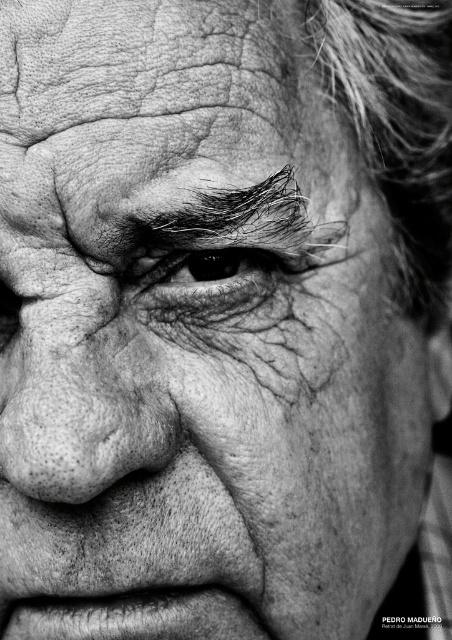
Is smooth skin forehead at upper center closer to camera compared to dull skin nose at center?

No, it is not.

Does smooth skin forehead at upper center come behind dull skin nose at center?

Yes, it is.

Which is in front, point (123, 72) or point (59, 420)?

Point (59, 420) is more forward.

Identify the location of smooth skin forehead at upper center. This screenshot has height=640, width=452. (140, 61).

Does point (262, 84) come closer to viewer compared to point (169, 205)?

No, it is not.

Between point (32, 88) and point (318, 262), which one is positioned in front?

Point (32, 88) is more forward.

Does point (169, 67) come closer to viewer compared to point (281, 170)?

That is True.

Locate an element on the screen. The image size is (452, 640). smooth skin forehead at upper center is located at coordinates (140, 61).

This screenshot has height=640, width=452. Describe the element at coordinates (235, 221) in the screenshot. I see `dark hair at upper center` at that location.

Who is more forward, (235,230) or (217,289)?

Point (235,230) is more forward.

The width and height of the screenshot is (452, 640). What are the coordinates of `dark hair at upper center` in the screenshot? It's located at (235, 221).